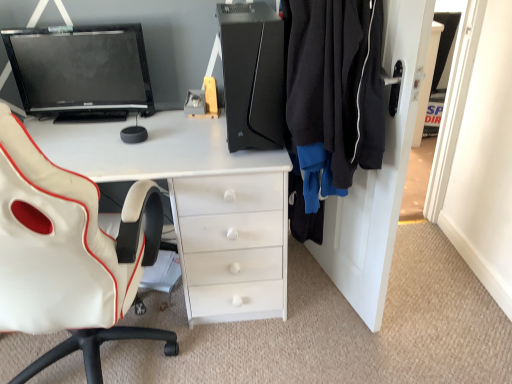
Where is `vacant area that lies between matte black monitor at upper left and black matte computer tower at center`? Image resolution: width=512 pixels, height=384 pixels. vacant area that lies between matte black monitor at upper left and black matte computer tower at center is located at coordinates (164, 130).